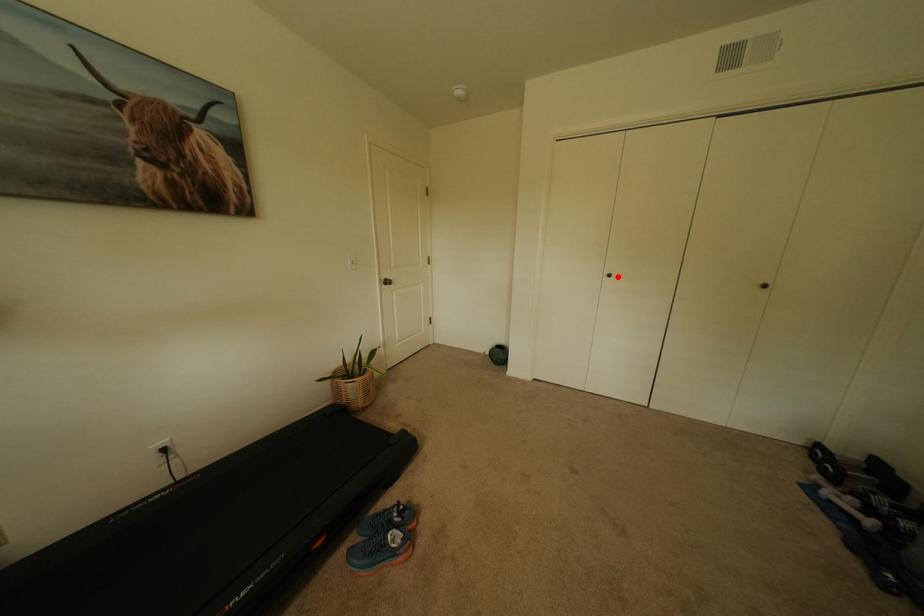
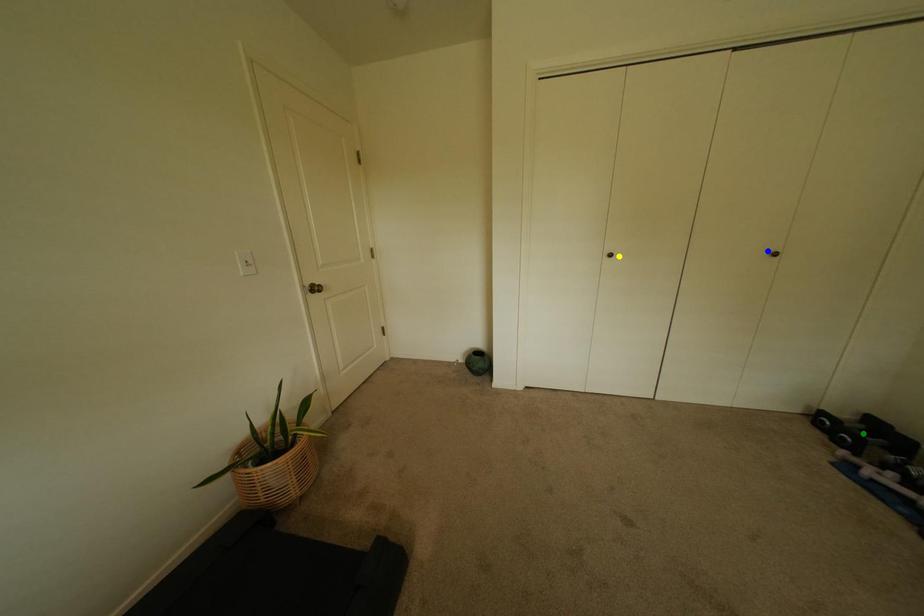
Question: I am providing you with two images of the same scene from different viewpoints. A red point is marked on the first image. You are given multiple points on the second image. Can you choose the point in image 2 that corresponds to the point in image 1?

Choices:
 (A) blue point
 (B) yellow point
 (C) green point

Answer: (B)